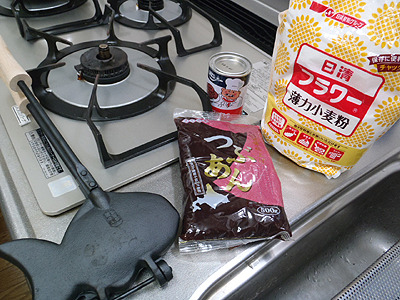
Find the location of a particular element. The height and width of the screenshot is (300, 400). wood floor is located at coordinates (13, 279), (4, 237).